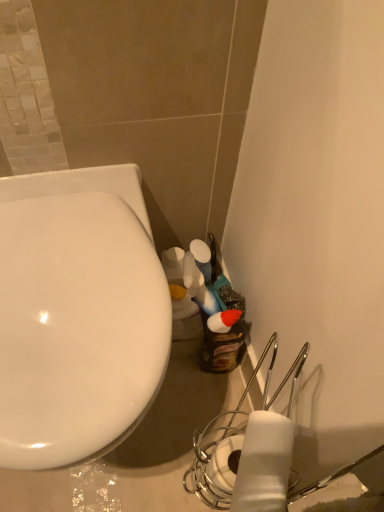
Question: Considering the positions of white matte toilet paper at lower right and white glossy toilet at left in the image, is white matte toilet paper at lower right taller or shorter than white glossy toilet at left?

Choices:
 (A) short
 (B) tall

Answer: (A)

Question: Considering the positions of white matte toilet paper at lower right and white glossy toilet at left in the image, is white matte toilet paper at lower right wider or thinner than white glossy toilet at left?

Choices:
 (A) thin
 (B) wide

Answer: (A)

Question: Do you think white matte toilet paper at lower right is within white glossy toilet at left, or outside of it?

Choices:
 (A) inside
 (B) outside

Answer: (B)

Question: Which is correct: white glossy toilet at left is inside white matte toilet paper at lower right, or outside of it?

Choices:
 (A) outside
 (B) inside

Answer: (A)

Question: From a real-world perspective, relative to white matte toilet paper at lower right, is white glossy toilet at left vertically above or below?

Choices:
 (A) above
 (B) below

Answer: (B)

Question: Is white glossy toilet at left to the left or to the right of white matte toilet paper at lower right in the image?

Choices:
 (A) left
 (B) right

Answer: (A)

Question: Is white glossy toilet at left in front of or behind white matte toilet paper at lower right in the image?

Choices:
 (A) behind
 (B) front

Answer: (A)